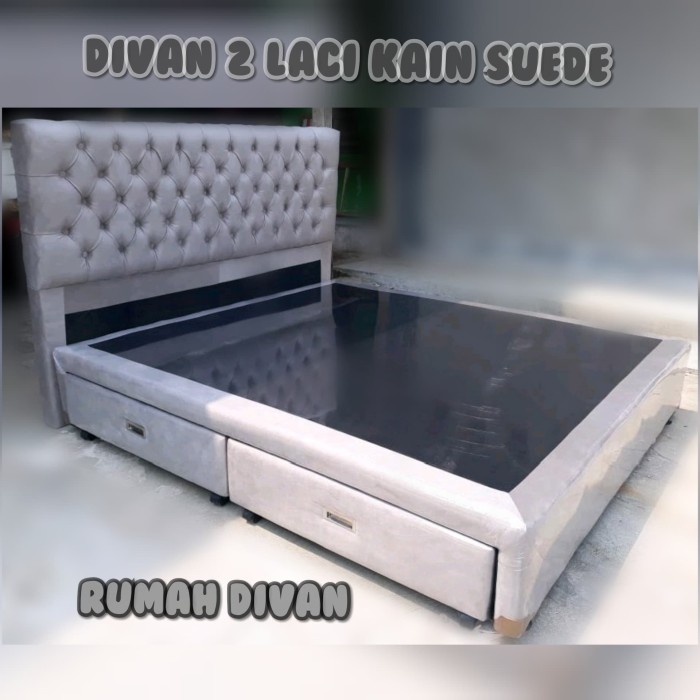
The image size is (700, 700). I want to click on black metal wheels on bed frame, so click(x=82, y=430), click(x=222, y=505), click(x=248, y=522).